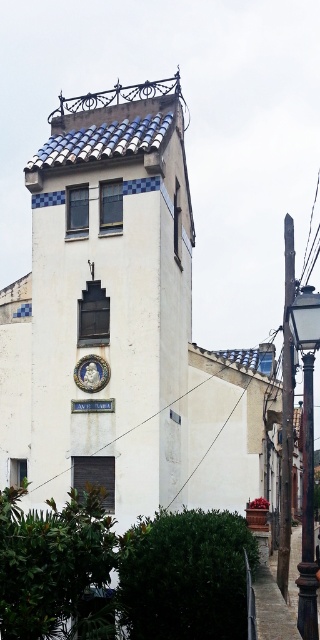
Question: Which object appears closest to the camera in this image?

Choices:
 (A) black wrought iron pole at right
 (B) metallic gray pole at right
 (C) dark brown wooden post at lower right
 (D) white matte clock tower at center

Answer: (A)

Question: Which point appears farthest from the camera in this image?

Choices:
 (A) (304, 577)
 (B) (288, 282)
 (C) (296, 541)

Answer: (C)

Question: Can you confirm if green leafy hedge at lower center is wider than dark brown wooden post at lower right?

Choices:
 (A) no
 (B) yes

Answer: (A)

Question: Which object appears farthest from the camera in this image?

Choices:
 (A) white matte clock tower at center
 (B) green leafy hedge at lower left

Answer: (A)

Question: Is white matte clock tower at center above metallic gray pole at right?

Choices:
 (A) yes
 (B) no

Answer: (B)

Question: Is the position of metallic gray pole at right more distant than that of dark brown wooden post at lower right?

Choices:
 (A) no
 (B) yes

Answer: (B)